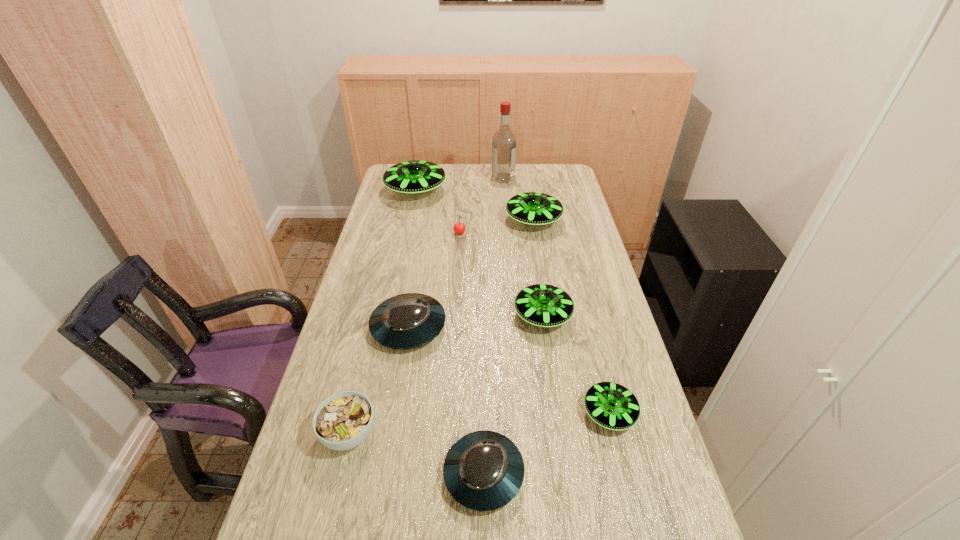
At what (x,y) coordinates should I click in order to perform the action: click on green saucer identified as the closest to the tallest saucer. Please return your answer as a coordinate pair (x, y). Looking at the image, I should click on (531, 208).

Where is `green saucer identified as the second closest to the second tallest saucer`? This screenshot has height=540, width=960. green saucer identified as the second closest to the second tallest saucer is located at coordinates (543, 305).

The image size is (960, 540). Identify the location of gray saucer that is the closest to the fifth shortest saucer. (406, 321).

Select which gray saucer is the second closest to the liquor. Please provide its 2D coordinates. Your answer should be formatted as a tuple, i.e. [(x, y)], where the tuple contains the x and y coordinates of a point satisfying the conditions above.

[(484, 470)]

This screenshot has width=960, height=540. Identify the location of vacant area in the image that satisfies the following two spatial constraints: 1. on the front-facing side of the liquor; 2. on the right side of the nearest green saucer. (521, 413).

Identify the location of free spot that satisfies the following two spatial constraints: 1. on the back side of the red cherry; 2. on the right side of the soup bowl. The image size is (960, 540). (397, 235).